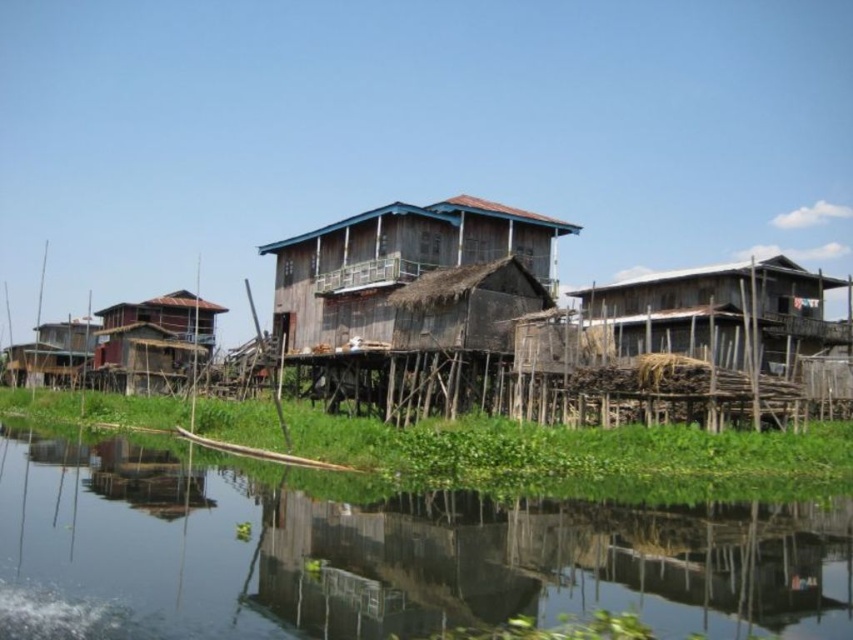
Question: Which object is farther from the camera taking this photo?

Choices:
 (A) weathered wood houses at center
 (B) green grassy river at center
 (C) weathered wood hut at center

Answer: (C)

Question: Among these objects, which one is nearest to the camera?

Choices:
 (A) weathered wood hut at center
 (B) wooden hut at center
 (C) weathered wood houses at center
 (D) brown wooden hut at right

Answer: (C)

Question: Does weathered wood houses at center have a greater width compared to weathered wood hut at center?

Choices:
 (A) yes
 (B) no

Answer: (A)

Question: Is weathered wood houses at center bigger than weathered wood hut at center?

Choices:
 (A) no
 (B) yes

Answer: (B)

Question: Can you confirm if weathered wood hut at center is positioned below brown wooden hut at right?

Choices:
 (A) yes
 (B) no

Answer: (B)

Question: Which point is closer to the camera?

Choices:
 (A) (549, 246)
 (B) (428, 250)
 (C) (618, 305)
 (D) (196, 364)

Answer: (B)